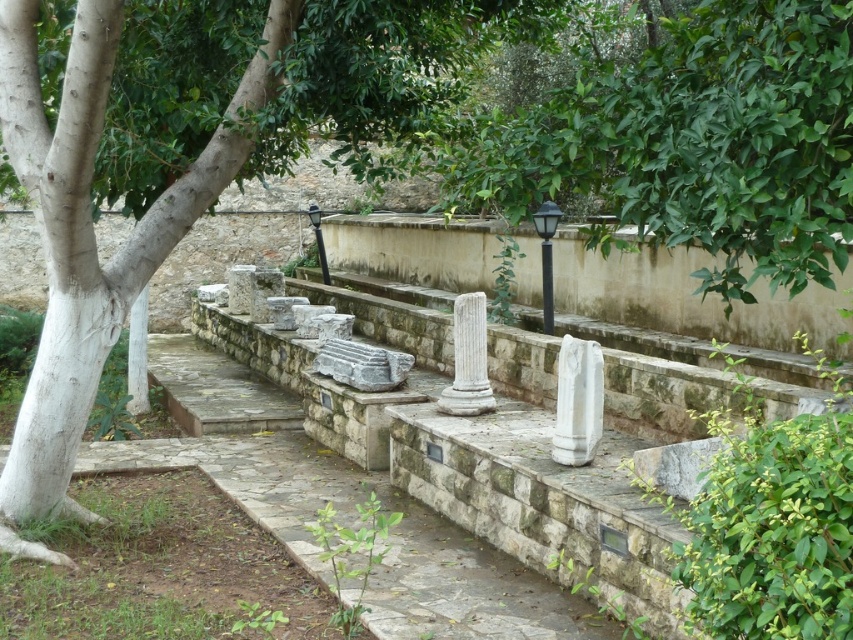
Question: Is white marble pillar at center closer to the viewer compared to white marble pillar at lower left?

Choices:
 (A) yes
 (B) no

Answer: (A)

Question: Can you confirm if green leafy tree at center is positioned to the left of white marble column at center?

Choices:
 (A) yes
 (B) no

Answer: (A)

Question: Which of the following is the closest to the observer?

Choices:
 (A) white marble column at center
 (B) green leafy tree at center
 (C) white marble pillar at center

Answer: (B)

Question: Observing the image, what is the correct spatial positioning of green leafy tree at center in reference to white marble pillar at center?

Choices:
 (A) below
 (B) above

Answer: (B)

Question: Which of the following is the closest to the observer?

Choices:
 (A) (131, 348)
 (B) (471, 321)
 (C) (587, 346)
 (D) (50, 476)

Answer: (D)

Question: Which point appears farthest from the camera in this image?

Choices:
 (A) (477, 404)
 (B) (144, 288)
 (C) (21, 104)
 (D) (587, 419)

Answer: (A)